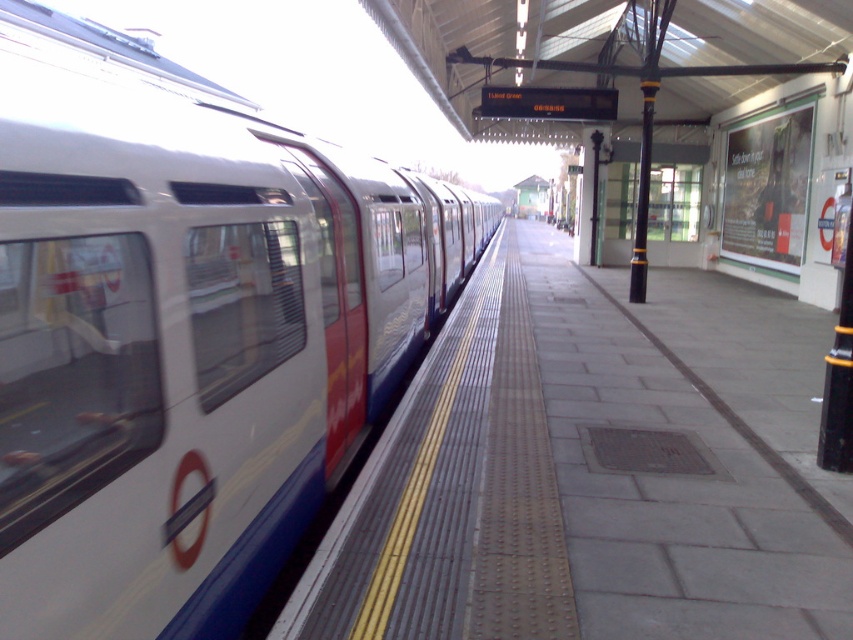
Can you confirm if white glossy train at left is positioned above metallic gray platform at center?

Correct, white glossy train at left is located above metallic gray platform at center.

Between white glossy train at left and metallic gray platform at center, which one has less height?

With less height is metallic gray platform at center.

Who is more forward, (332, 188) or (735, 621)?

Point (735, 621) is more forward.

Image resolution: width=853 pixels, height=640 pixels. In order to click on white glossy train at left in this screenshot , I will do `click(186, 330)`.